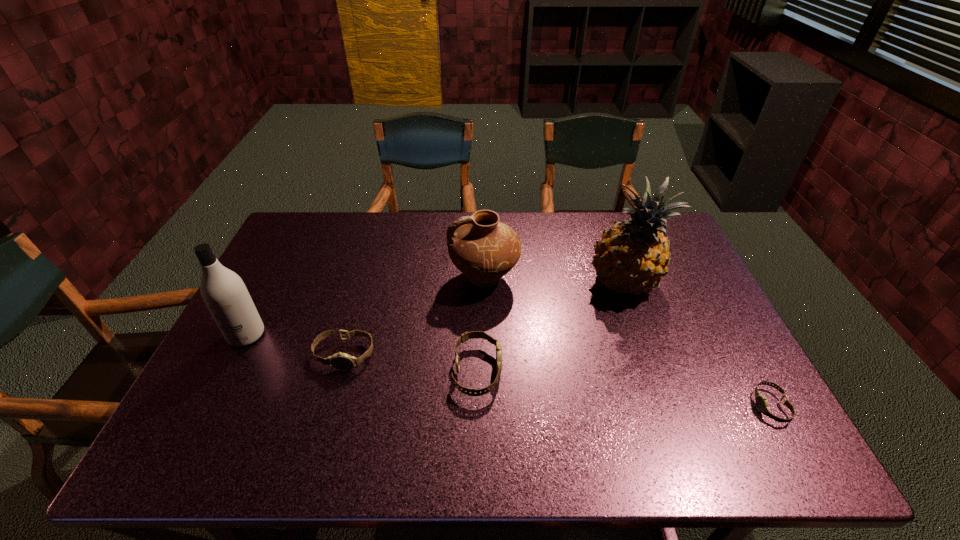
To ensure equal spacing by inserting another watch among them, please point out a vacant spot for this new watch. Please provide its 2D coordinates. Your answer should be formatted as a tuple, i.e. [(x, y)], where the tuple contains the x and y coordinates of a point satisfying the conditions above.

[(618, 388)]